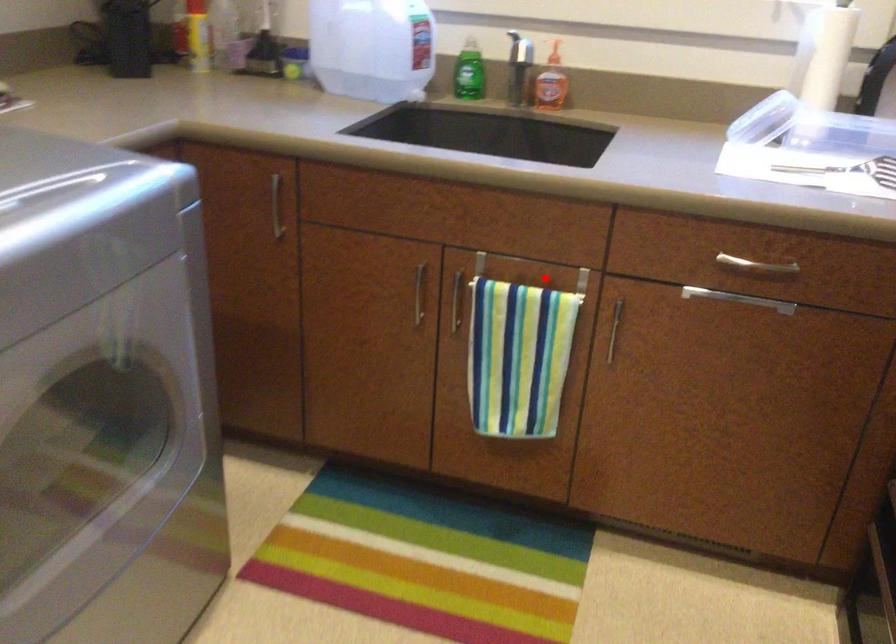
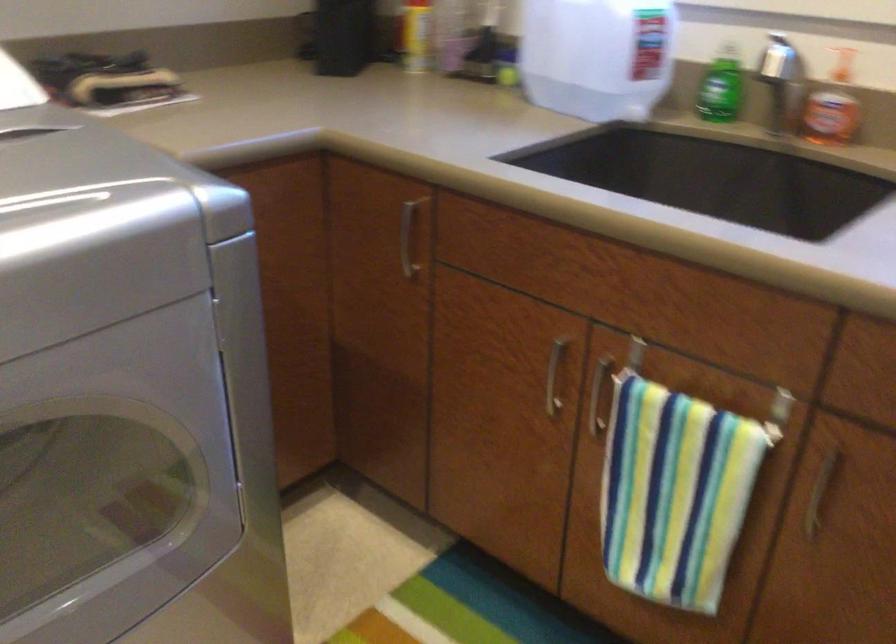
Question: I am providing you with two images of the same scene from different viewpoints. In image1, a red point is highlighted. Considering the same 3D point in image2, which of the following is correct?

Choices:
 (A) It is closer
 (B) It is farther

Answer: (A)